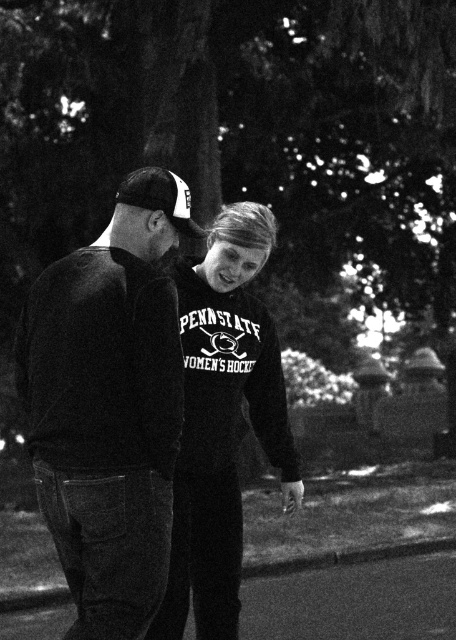
Describe the element at coordinates (108, 404) in the screenshot. I see `dark gray sweater at center` at that location.

Does dark gray sweater at center have a greater height compared to velvet black sweatshirt at center?

Incorrect, dark gray sweater at center's height is not larger of velvet black sweatshirt at center's.

Who is more forward, (x=82, y=628) or (x=164, y=632)?

Point (x=82, y=628)

I want to click on dark gray sweater at center, so (108, 404).